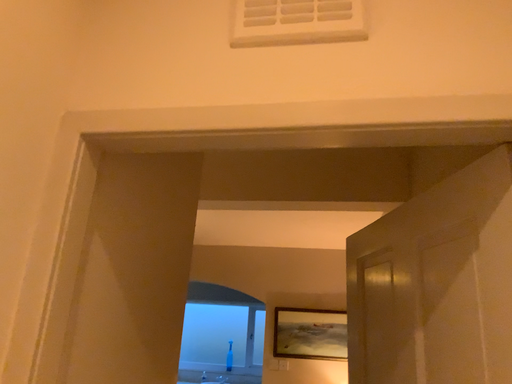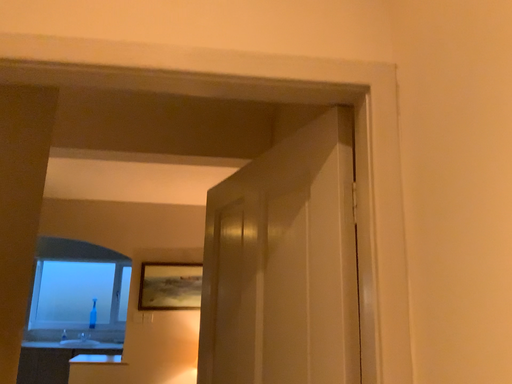
Question: How did the camera likely rotate when shooting the video?

Choices:
 (A) rotated right
 (B) rotated left

Answer: (A)